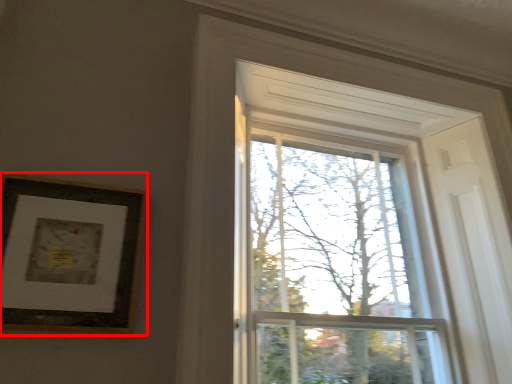
Question: In this image, where is picture frame (annotated by the red box) located relative to glass window?

Choices:
 (A) left
 (B) right

Answer: (A)